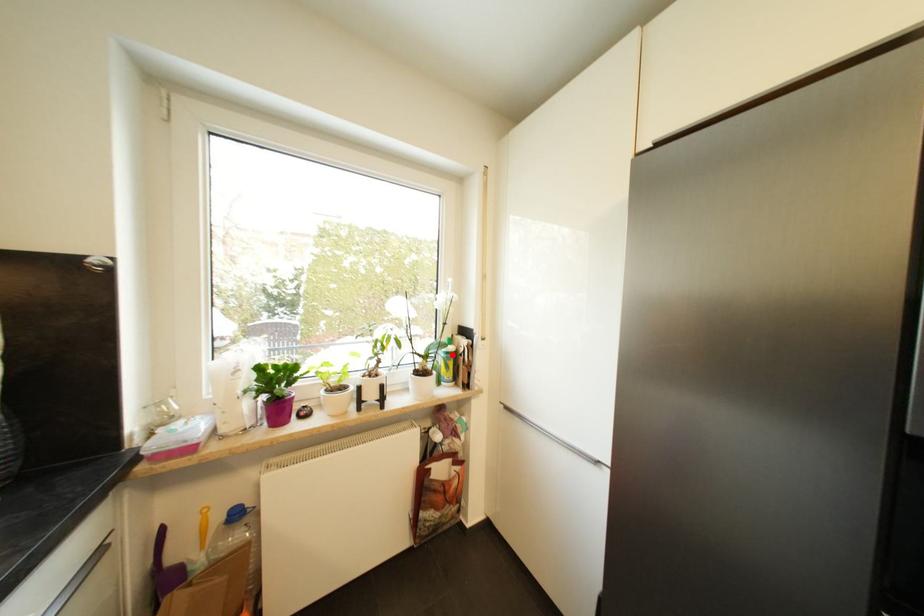
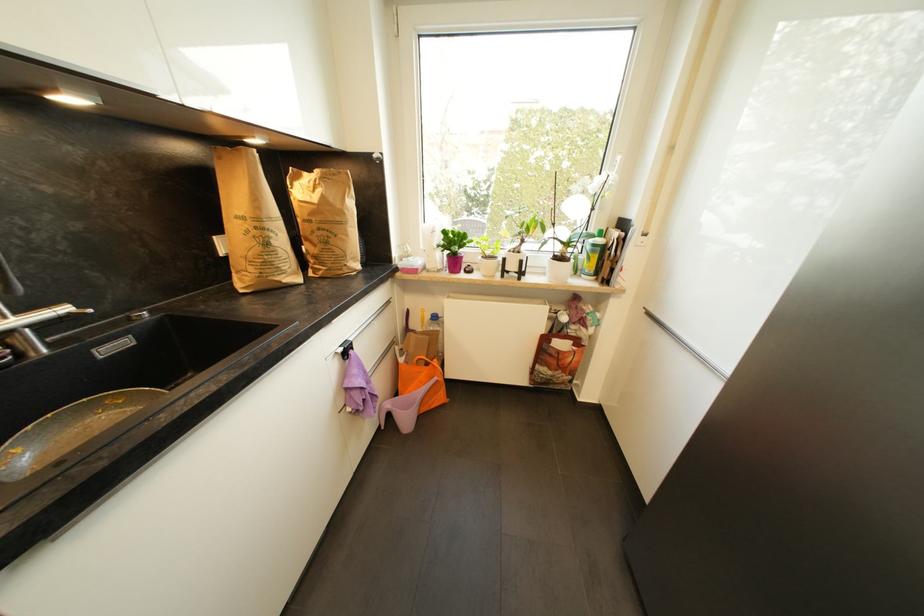
Question: I am providing you with two images of the same scene from different viewpoints. In image1, a red point is highlighted. Considering the same 3D point in image2, which of the following is correct?

Choices:
 (A) It is closer
 (B) It is farther

Answer: (A)